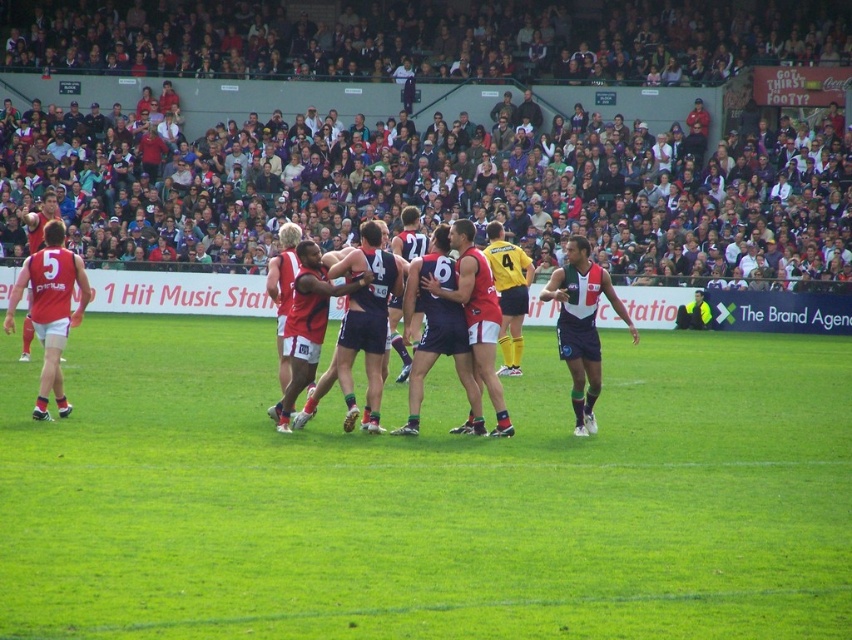
Question: Among these objects, which one is nearest to the camera?

Choices:
 (A) dark gray crowd at upper center
 (B) green grass at center
 (C) matte red singlet at left

Answer: (B)

Question: Which point is farther to the camera?

Choices:
 (A) matte red singlet at left
 (B) dark blue jersey at right

Answer: (B)

Question: Is green grass at center wider than dark gray crowd at upper center?

Choices:
 (A) no
 (B) yes

Answer: (A)

Question: Can you confirm if green grass at center is positioned above matte red singlet at left?

Choices:
 (A) yes
 (B) no

Answer: (B)

Question: Is green grass at center to the right of matte red singlet at left from the viewer's perspective?

Choices:
 (A) no
 (B) yes

Answer: (B)

Question: Estimate the real-world distances between objects in this image. Which object is farther from the dark blue jersey at right?

Choices:
 (A) dark gray crowd at upper center
 (B) matte red singlet at left

Answer: (A)